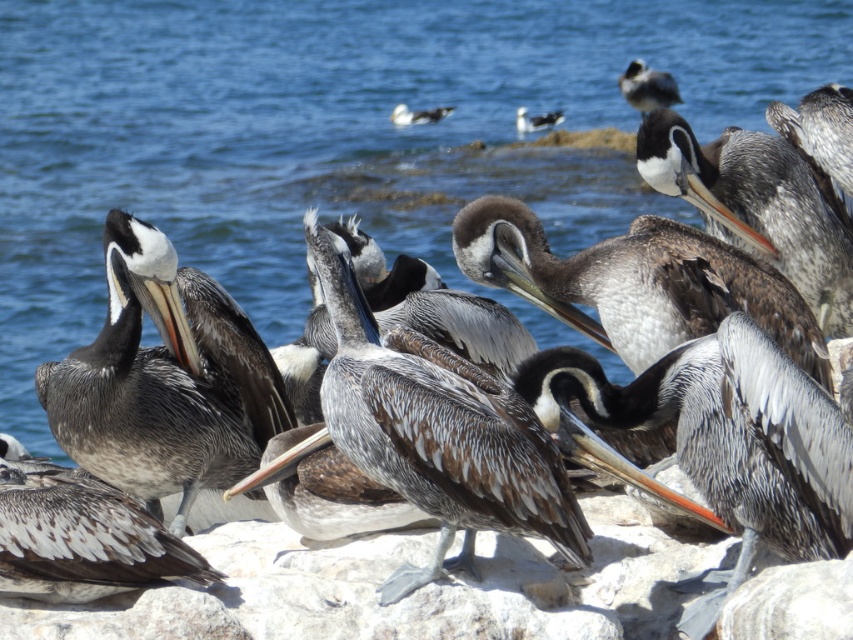
In the scene shown: Between blue water at center and brown speckled pelican at upper right, which one is positioned lower?

Positioned lower is blue water at center.

The width and height of the screenshot is (853, 640). Describe the element at coordinates (339, 136) in the screenshot. I see `blue water at center` at that location.

Where is `blue water at center`? blue water at center is located at coordinates (339, 136).

Is brown speckled feathers at center above white glossy seagull at upper center?

No.

Which is more to the right, brown speckled feathers at center or white glossy seagull at upper center?

white glossy seagull at upper center is more to the right.

The height and width of the screenshot is (640, 853). What do you see at coordinates (80, 536) in the screenshot?
I see `brown speckled feathers at center` at bounding box center [80, 536].

Locate an element on the screen. This screenshot has width=853, height=640. brown speckled feathers at center is located at coordinates (80, 536).

Can you confirm if brown feathered pelican at center is smaller than white glossy seagull at center?

No.

Find the location of a particular element. brown feathered pelican at center is located at coordinates (164, 380).